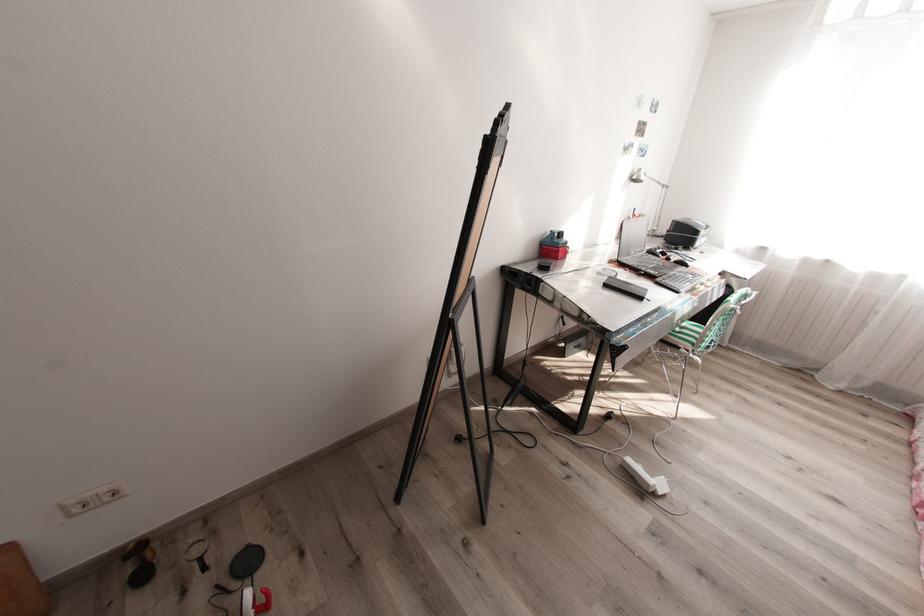
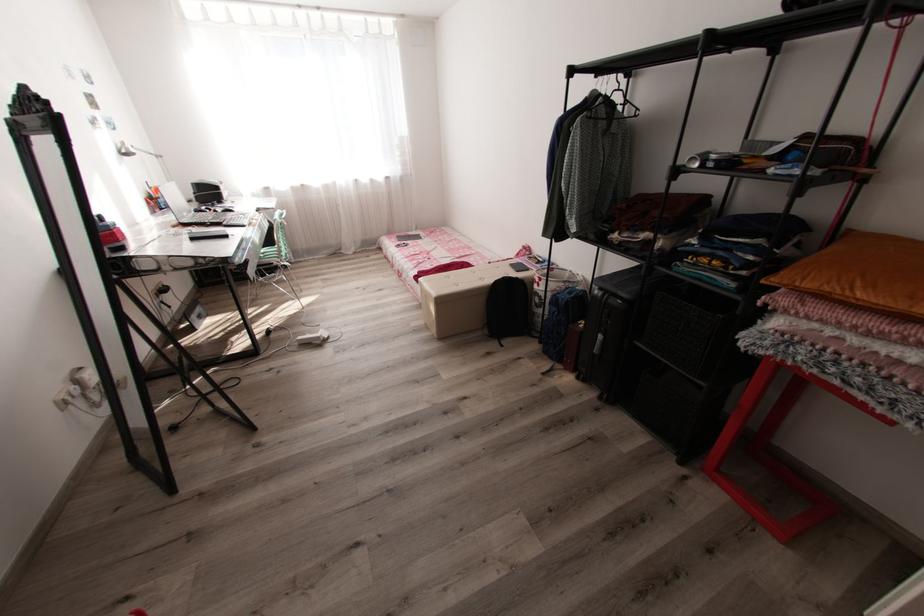
Locate, in the second image, the point that corresponds to point (611, 285) in the first image.

(198, 238)